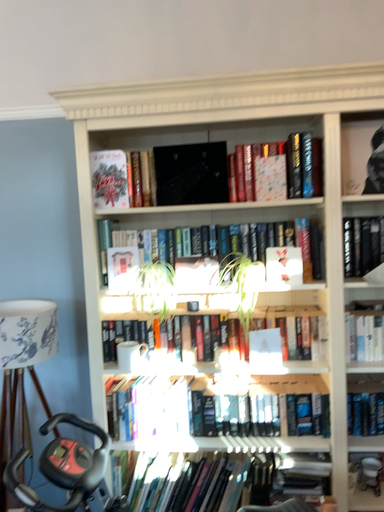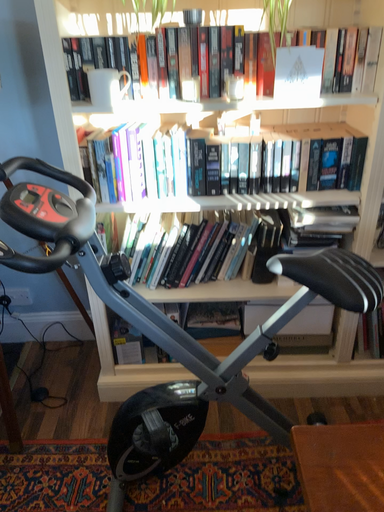
Question: Which way did the camera rotate in the video?

Choices:
 (A) rotated downward
 (B) rotated upward

Answer: (A)